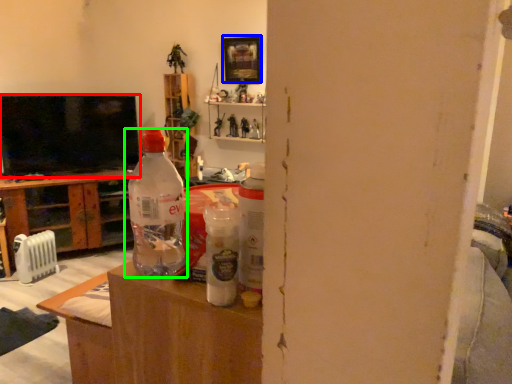
Question: Estimate the real-world distances between objects in this image. Which object is closer to television (highlighted by a red box), picture frame (highlighted by a blue box) or bottle (highlighted by a green box)?

Choices:
 (A) picture frame
 (B) bottle

Answer: (A)